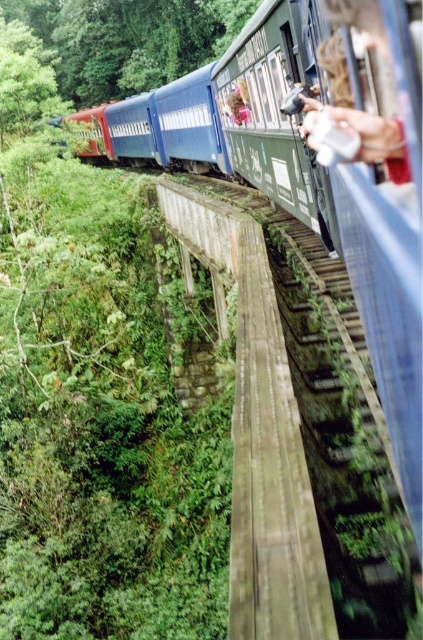
Question: Which point is closer to the camera taking this photo?

Choices:
 (A) (286, 394)
 (B) (172, 17)

Answer: (A)

Question: Does blue painted metal train car at center appear on the left side of green leafy tree at upper left?

Choices:
 (A) yes
 (B) no

Answer: (B)

Question: Which of the following is the farthest from the observer?

Choices:
 (A) (230, 595)
 (B) (233, 93)
 (C) (118, 113)

Answer: (C)

Question: Is blue painted metal train car at center bigger than green stone bridge at center?

Choices:
 (A) yes
 (B) no

Answer: (A)

Question: Which of the following is the farthest from the observer?

Choices:
 (A) (118, 116)
 (B) (241, 352)
 (C) (230, 108)

Answer: (A)

Question: Does green leafy tree at upper left have a lesser width compared to light brown hair at upper center?

Choices:
 (A) no
 (B) yes

Answer: (A)